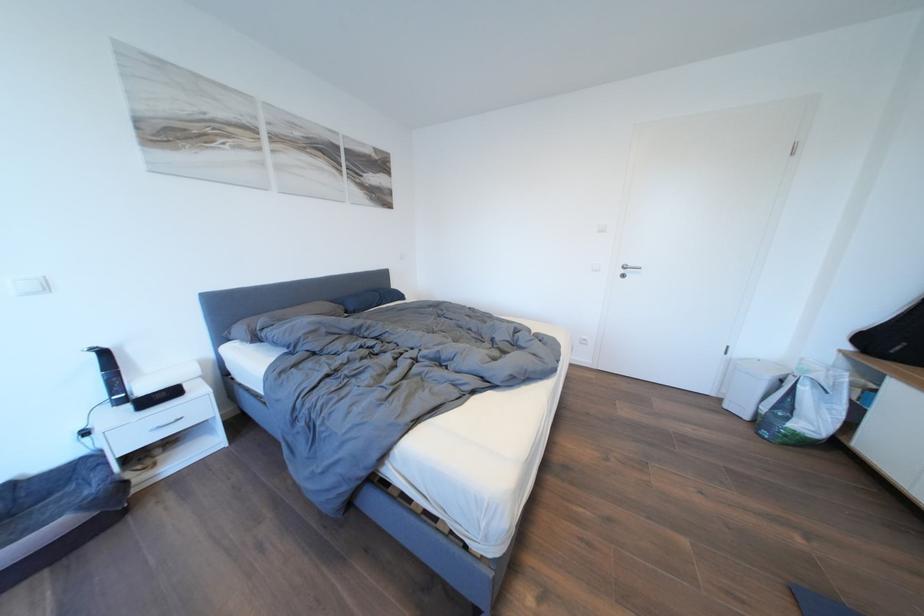
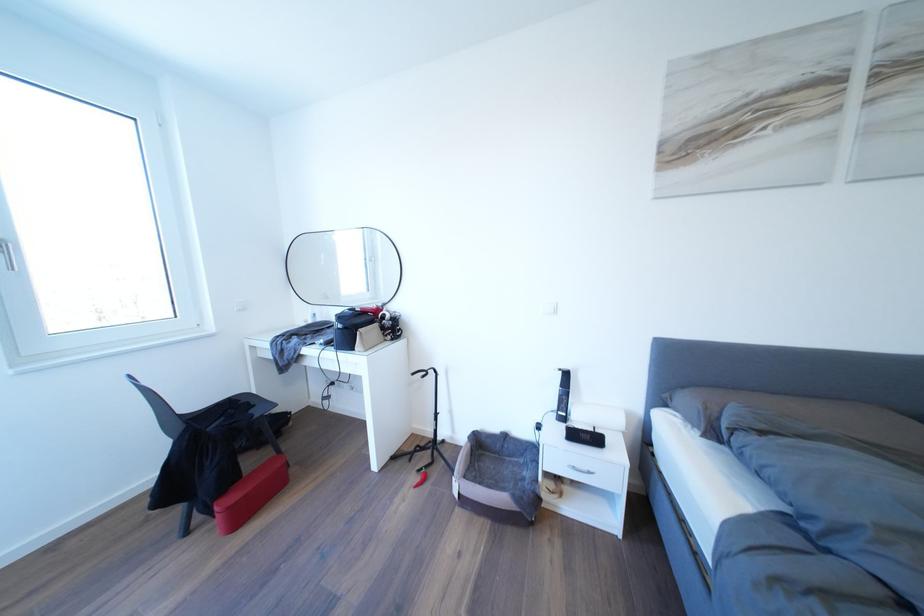
Question: The camera is either moving clockwise (left) or counter-clockwise (right) around the object. The first image is from the beginning of the video and the second image is from the end. Is the camera moving left or right when shooting the video?

Choices:
 (A) Left
 (B) Right

Answer: (B)